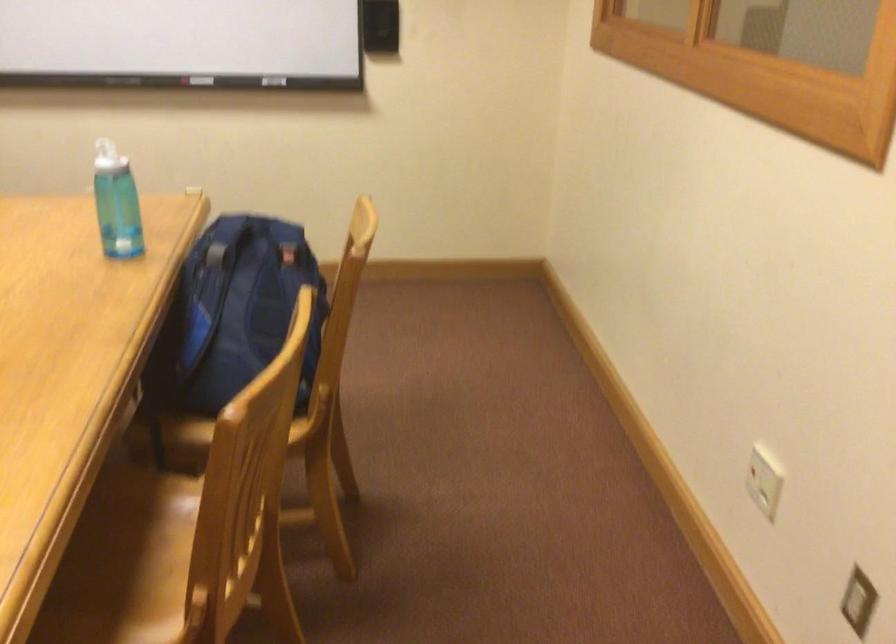
Where is `light switch`? This screenshot has height=644, width=896. light switch is located at coordinates (764, 480).